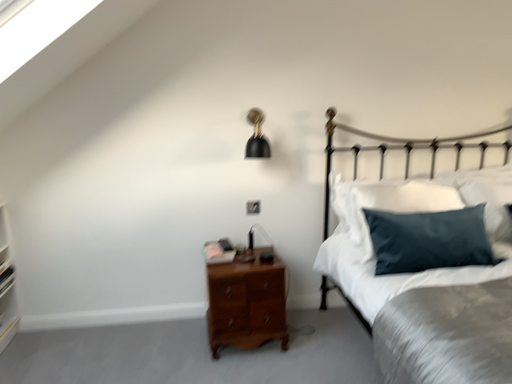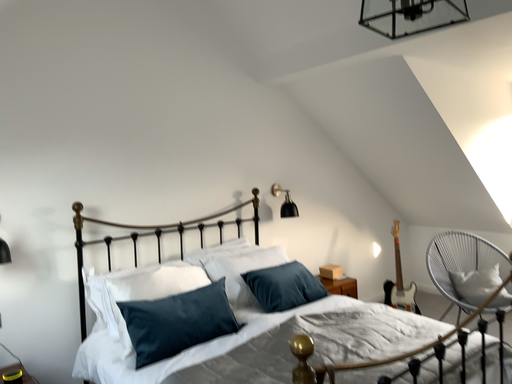
Question: How did the camera likely rotate when shooting the video?

Choices:
 (A) rotated left
 (B) rotated right

Answer: (B)